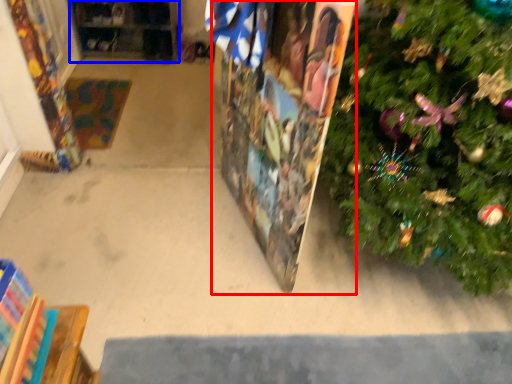
Question: Which of the following is the closest to the observer, bulletin board (highlighted by a red box) or shelf (highlighted by a blue box)?

Choices:
 (A) bulletin board
 (B) shelf

Answer: (A)